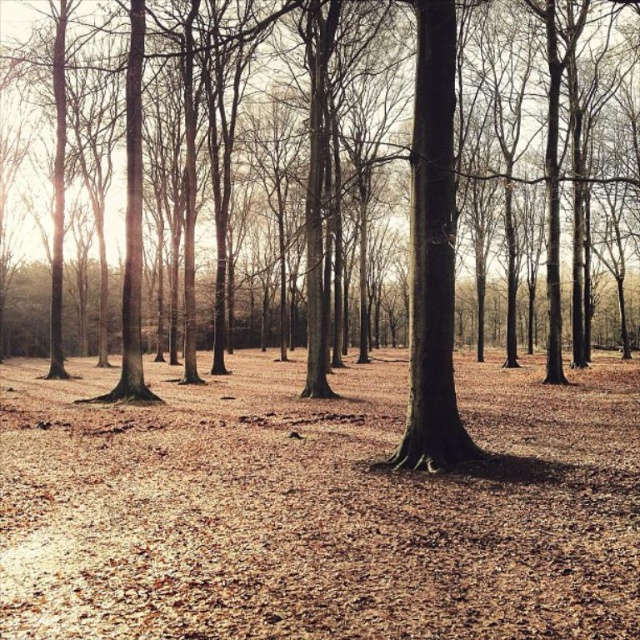
You are standing in the forest and want to place a small decorative stone exactly at the center of the brown leafy ground at center. According to the image, what are the coordinates where you should place the stone?

The coordinates for the center of the brown leafy ground at center are at point (316, 506), so you should place the stone there.

You are a hiker who wants to walk from the starting point to the tree trunk. You see the brown leafy ground at center and the brown matte tree trunk at center. Which object is closer to you as you start walking?

The brown leafy ground at center is closer to you because it is in front of the brown matte tree trunk at center.